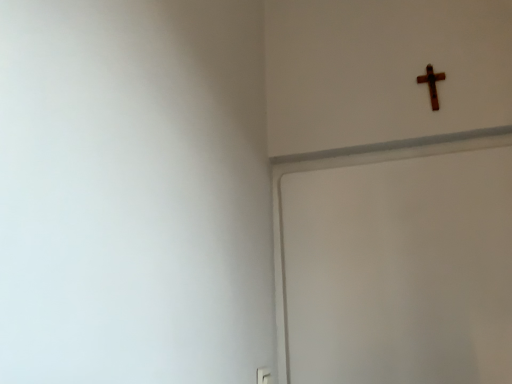
This screenshot has width=512, height=384. Describe the element at coordinates (432, 84) in the screenshot. I see `wooden cross at upper right` at that location.

At what (x,y) coordinates should I click in order to perform the action: click on wooden cross at upper right. Please return your answer as a coordinate pair (x, y). Image resolution: width=512 pixels, height=384 pixels. Looking at the image, I should click on (432, 84).

The image size is (512, 384). I want to click on wooden cross at upper right, so click(x=432, y=84).